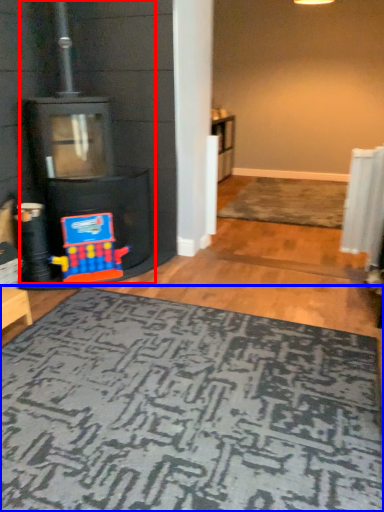
Question: Which point is closer to the camera, fireplace (highlighted by a red box) or mat (highlighted by a blue box)?

Choices:
 (A) fireplace
 (B) mat

Answer: (B)